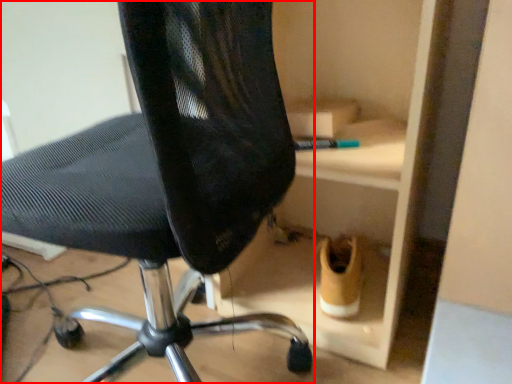
Question: Where is chair (annotated by the red box) located in relation to footwear in the image?

Choices:
 (A) left
 (B) right

Answer: (A)